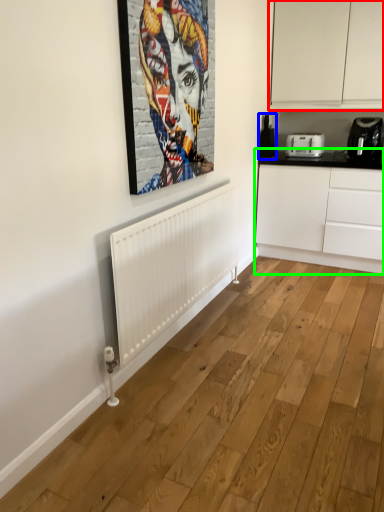
Question: Which object is positioned closest to cabinetry (highlighted by a red box)? Select from appliance (highlighted by a blue box) and cabinetry (highlighted by a green box).

Choices:
 (A) appliance
 (B) cabinetry

Answer: (A)